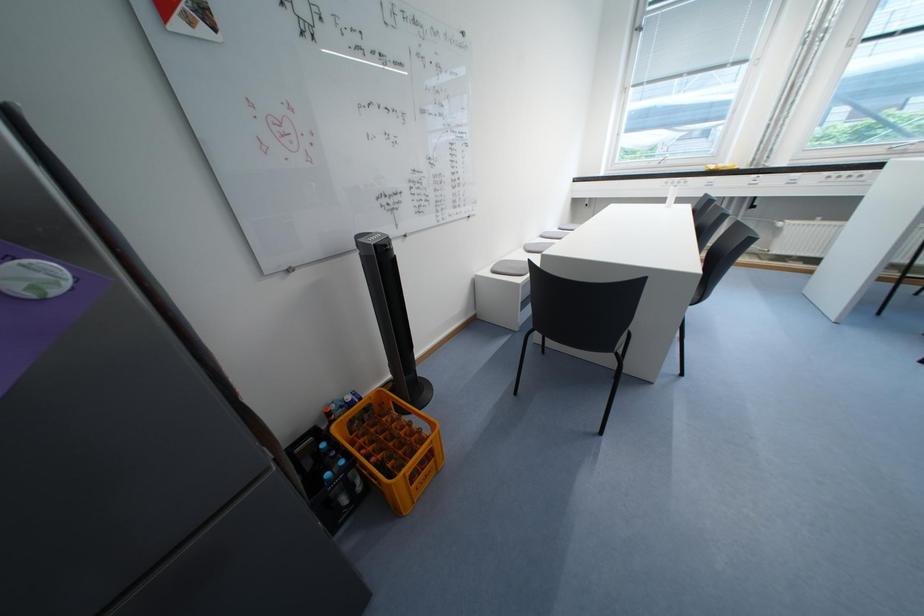
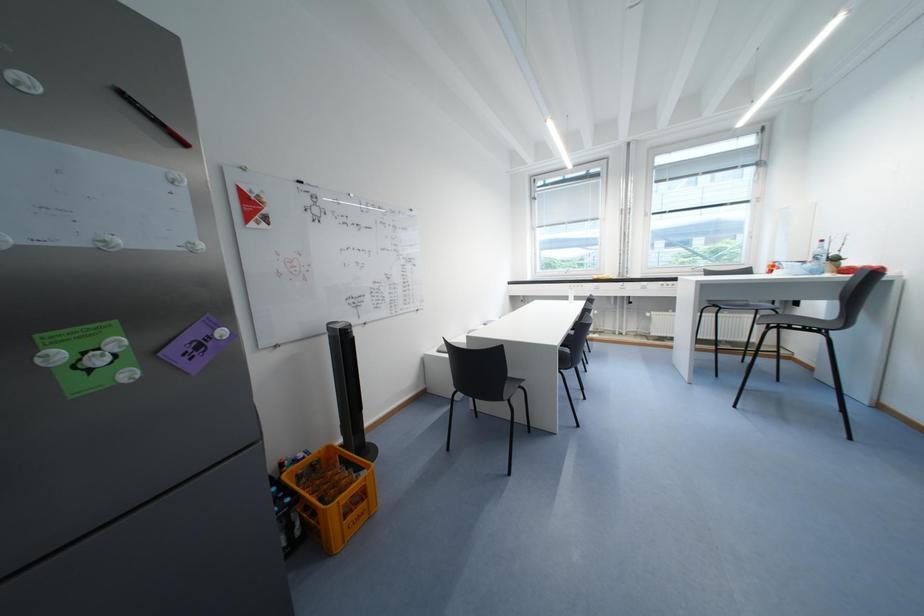
Question: How did the camera likely rotate?

Choices:
 (A) Left
 (B) Right
 (C) Up
 (D) Down

Answer: (C)